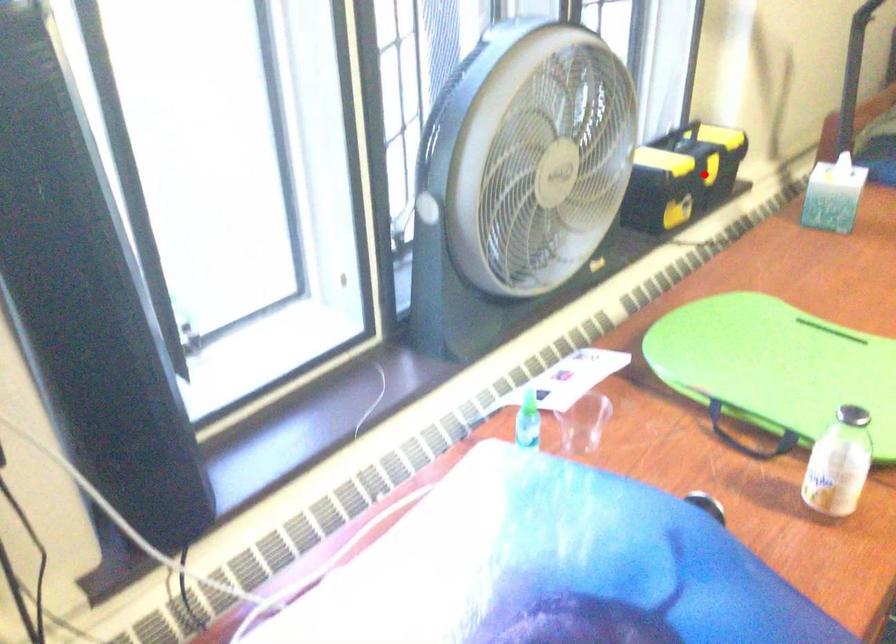
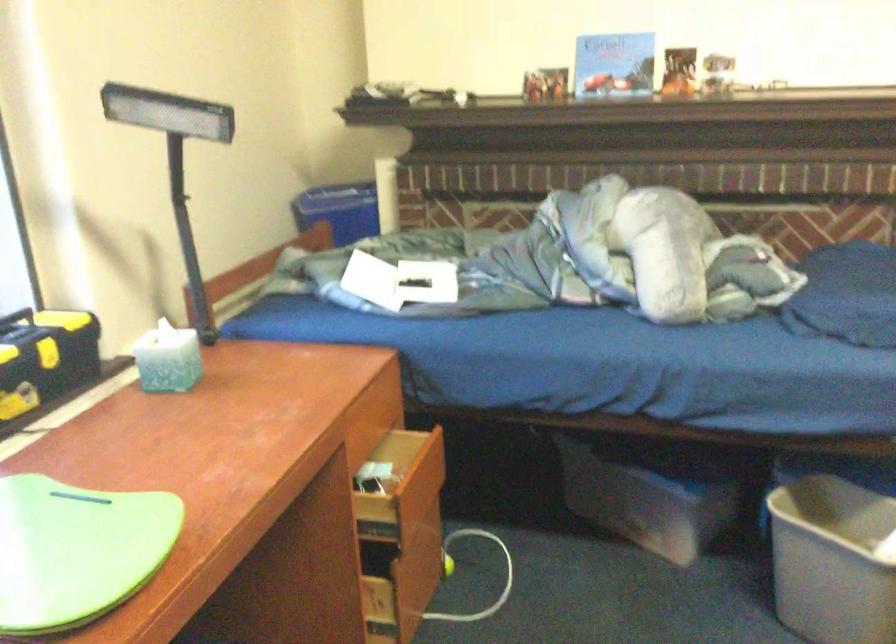
In the second image, find the point that corresponds to the highlighted location in the first image.

(46, 354)